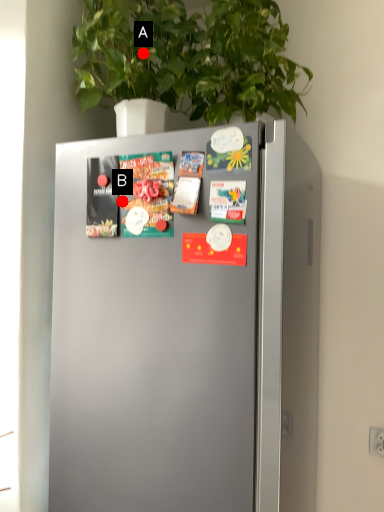
Question: Two points are circled on the image, labeled by A and B beside each circle. Which point is further to the camera?

Choices:
 (A) A is further
 (B) B is further

Answer: (A)